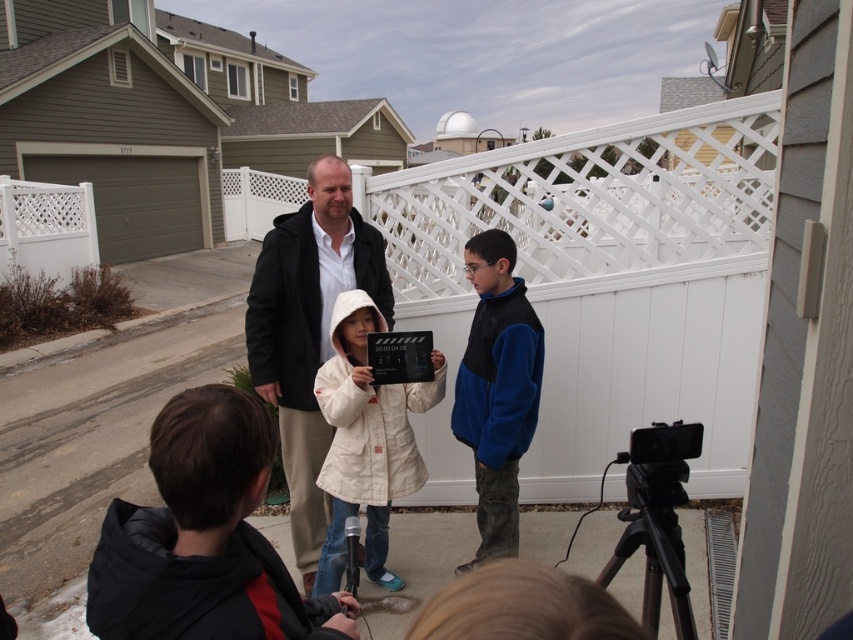
You are a photographer setting up a camera to capture the scene. The camera has a limited field of view that can only accommodate one person at a time. If you want to ensure that both the black fleece jacket at lower left and the blue fleece vest at center are fully visible in the frame, what adjustment should you make to the camera lens?

The black fleece jacket at lower left might be wider than the blue fleece vest at center, so you should use a wider angle lens to ensure both are fully visible.

You are a photographer positioned at the camera. You need to focus on both point (189, 419) and point (422, 474) in the image. Which point should you adjust your focus to first to ensure both are in focus?

You should focus on point (189, 419) first because it is closer to the camera. By focusing on the closer point, the farther point (422, 474) will also be in focus due to the depth of field.